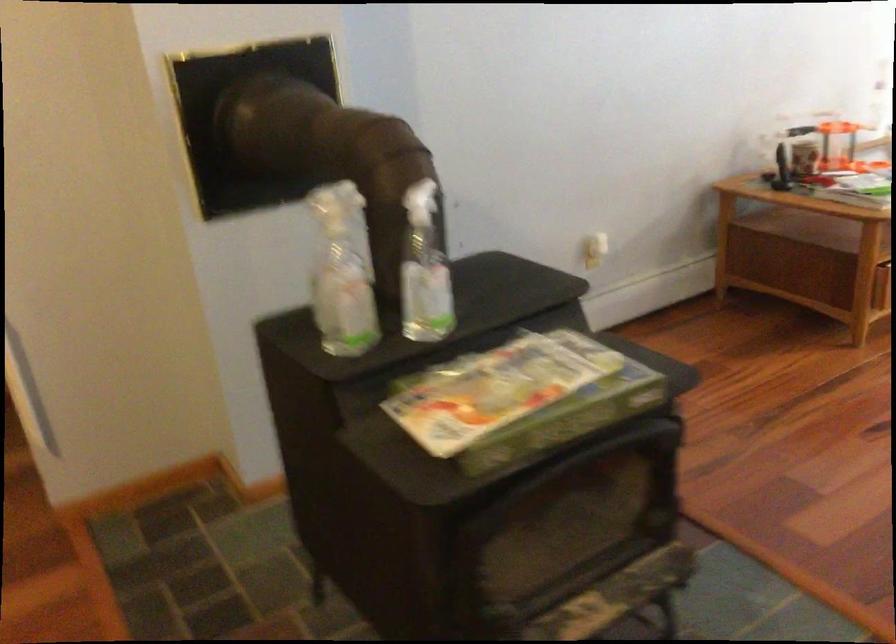
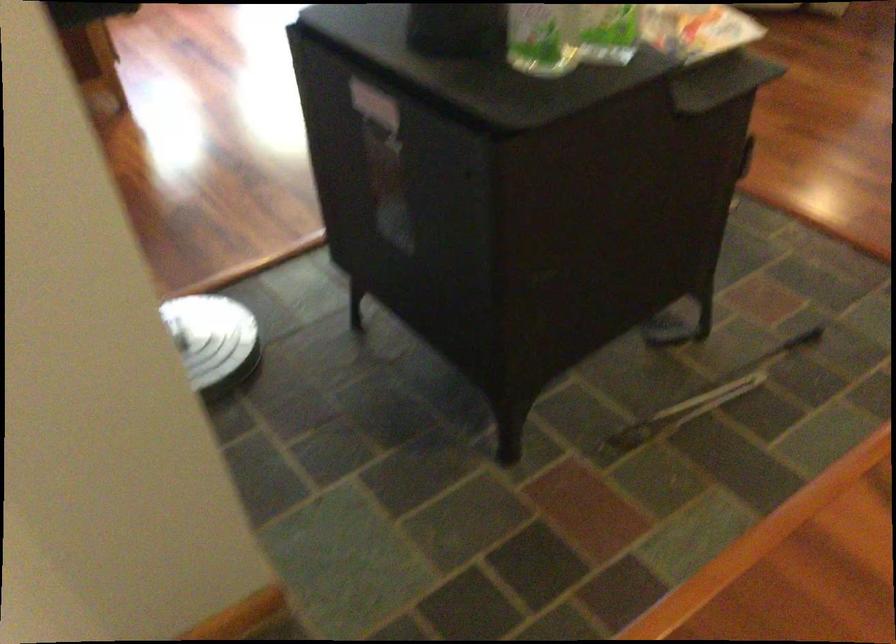
Locate, in the second image, the point that corresponds to point (380, 299) in the first image.

(375, 104)